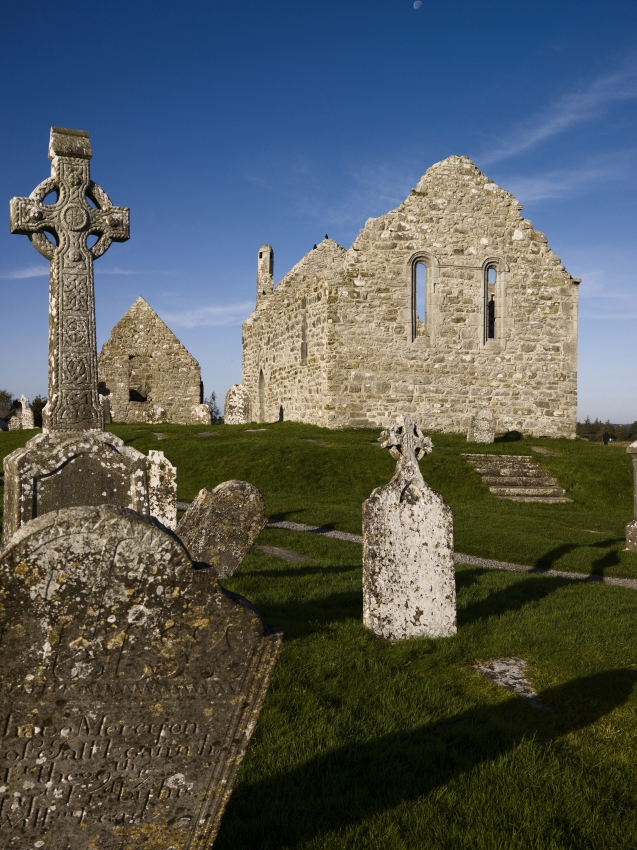
What are the coordinates of `window` in the screenshot? It's located at (140, 376), (419, 301), (490, 309).